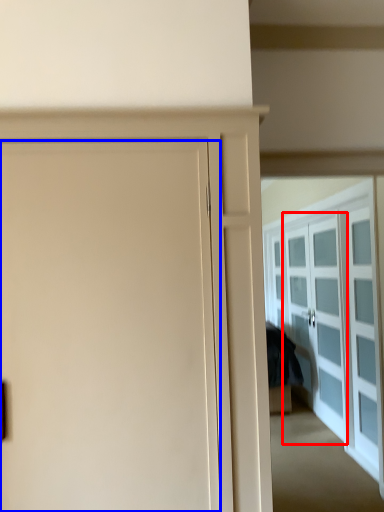
Question: Which point is further to the camera, screen door (highlighted by a red box) or door (highlighted by a blue box)?

Choices:
 (A) screen door
 (B) door

Answer: (A)